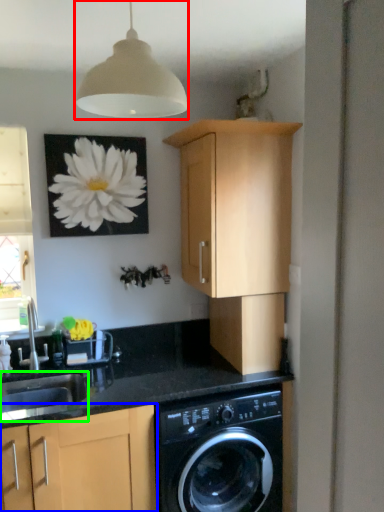
Question: Estimate the real-world distances between objects in this image. Which object is closer to lamp (highlighted by a red box), cabinetry (highlighted by a blue box) or sink (highlighted by a green box)?

Choices:
 (A) cabinetry
 (B) sink

Answer: (A)